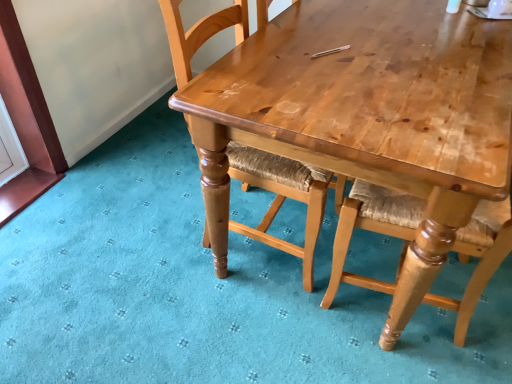
The image size is (512, 384). Describe the element at coordinates (371, 125) in the screenshot. I see `light brown wood table at upper center` at that location.

At what (x,y) coordinates should I click in order to perform the action: click on light brown wood table at upper center. Please return your answer as a coordinate pair (x, y). This screenshot has height=384, width=512. Looking at the image, I should click on (371, 125).

Where is `wooden woven seat at center`? The image size is (512, 384). wooden woven seat at center is located at coordinates (281, 197).

This screenshot has height=384, width=512. Describe the element at coordinates (281, 197) in the screenshot. I see `wooden woven seat at center` at that location.

Where is `light brown wood table at upper center`? Image resolution: width=512 pixels, height=384 pixels. light brown wood table at upper center is located at coordinates (371, 125).

Is light brown wood table at upper center at the right side of wooden woven seat at center?

Correct, you'll find light brown wood table at upper center to the right of wooden woven seat at center.

Does light brown wood table at upper center lie behind wooden woven seat at center?

That is False.

Considering the positions of point (289, 149) and point (257, 158), is point (289, 149) closer or farther from the camera than point (257, 158)?

Point (289, 149) is positioned closer to the camera compared to point (257, 158).

From the image's perspective, which is below, light brown wood table at upper center or wooden woven seat at center?

light brown wood table at upper center is shown below in the image.

From a real-world perspective, which object stands above the other?

In real-world perspective, light brown wood table at upper center is above.

Can you confirm if light brown wood table at upper center is thinner than wooden woven seat at center?

No.

Considering the sizes of objects light brown wood table at upper center and wooden woven seat at center in the image provided, who is taller, light brown wood table at upper center or wooden woven seat at center?

wooden woven seat at center is taller.

Does light brown wood table at upper center have a smaller size compared to wooden woven seat at center?

No, light brown wood table at upper center is not smaller than wooden woven seat at center.

Based on the photo, is light brown wood table at upper center located outside wooden woven seat at center?

Yes, light brown wood table at upper center is located beyond the bounds of wooden woven seat at center.

Is light brown wood table at upper center beside wooden woven seat at center?

light brown wood table at upper center and wooden woven seat at center are clearly separated.

Is light brown wood table at upper center oriented away from wooden woven seat at center?

light brown wood table at upper center is not turned away from wooden woven seat at center.

You are a GUI agent. You are given a task and a screenshot of the screen. Output one action in this format:
    pyautogui.click(x=<x>, y=<y>)
    Task: Click on the table in front of the wooden woven seat at center
    This screenshot has height=384, width=512.
    Given the screenshot: What is the action you would take?
    pyautogui.click(x=371, y=125)

Would you say wooden woven seat at center is to the left or to the right of light brown wood table at upper center in the picture?

wooden woven seat at center is to the left of light brown wood table at upper center.

Is the position of wooden woven seat at center more distant than that of light brown wood table at upper center?

That is True.

Which point is more forward, [168,36] or [447,219]?

The point [447,219] is closer.

From the image's perspective, is wooden woven seat at center above or below light brown wood table at upper center?

Clearly, from the image's perspective, wooden woven seat at center is above light brown wood table at upper center.

From a real-world perspective, which is physically below, wooden woven seat at center or light brown wood table at upper center?

From a 3D spatial view, wooden woven seat at center is below.

Does wooden woven seat at center have a greater width compared to light brown wood table at upper center?

No.

Can you confirm if wooden woven seat at center is shorter than light brown wood table at upper center?

No, wooden woven seat at center is not shorter than light brown wood table at upper center.

Between wooden woven seat at center and light brown wood table at upper center, which one has smaller size?

wooden woven seat at center is smaller.

Would you say wooden woven seat at center is outside light brown wood table at upper center?

Indeed, wooden woven seat at center is completely outside light brown wood table at upper center.

Is wooden woven seat at center beside light brown wood table at upper center?

No, wooden woven seat at center is not next to light brown wood table at upper center.

Is wooden woven seat at center turned away from light brown wood table at upper center?

Yes, wooden woven seat at center is positioned with its back facing light brown wood table at upper center.

Measure the distance between wooden woven seat at center and light brown wood table at upper center.

wooden woven seat at center is 12.51 inches from light brown wood table at upper center.

Where is `chair located underneath the light brown wood table at upper center (from a real-world perspective)`? chair located underneath the light brown wood table at upper center (from a real-world perspective) is located at coordinates (281, 197).

In the image, there is a light brown wood table at upper center. Where is `chair below it (from a real-world perspective)`? chair below it (from a real-world perspective) is located at coordinates (281, 197).

You are a GUI agent. You are given a task and a screenshot of the screen. Output one action in this format:
    pyautogui.click(x=<x>, y=<y>)
    Task: Click on the table in front of the wooden woven seat at center
    The image size is (512, 384).
    Given the screenshot: What is the action you would take?
    pyautogui.click(x=371, y=125)